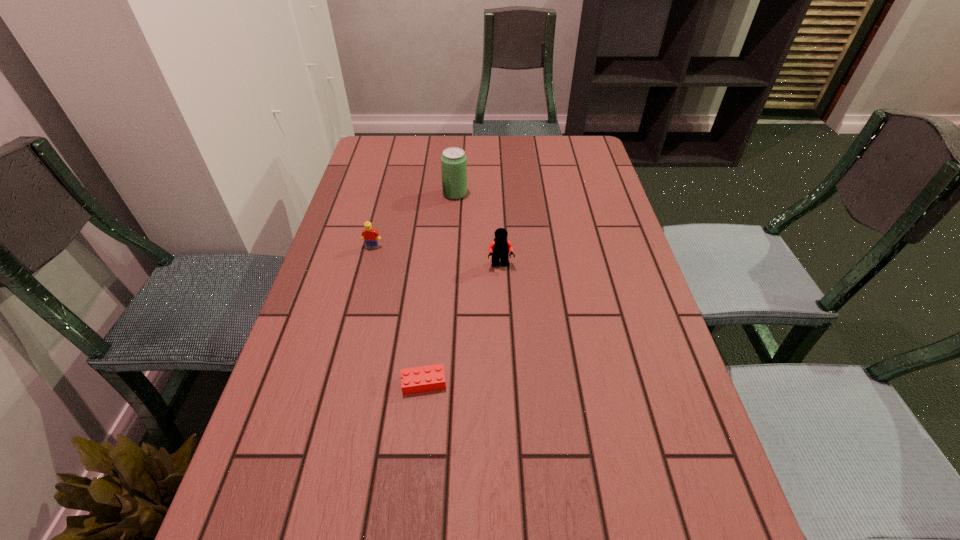
Identify which Lego is located as the third nearest to the soda. Please provide its 2D coordinates. Your answer should be formatted as a tuple, i.e. [(x, y)], where the tuple contains the x and y coordinates of a point satisfying the conditions above.

[(420, 379)]

Where is `Lego that is the second closest to the shortest object`? Lego that is the second closest to the shortest object is located at coordinates pos(369,235).

You are a GUI agent. You are given a task and a screenshot of the screen. Output one action in this format:
    pyautogui.click(x=<x>, y=<y>)
    Task: Click on the vacant space that satisfies the following two spatial constraints: 1. on the front-facing side of the nearest Lego; 2. on the left side of the second shortest object
    
    Given the screenshot: What is the action you would take?
    pyautogui.click(x=337, y=383)

Identify the location of free spot that satisfies the following two spatial constraints: 1. on the front-facing side of the shortest Lego; 2. on the right side of the leftmost Lego. This screenshot has height=540, width=960. (337, 383).